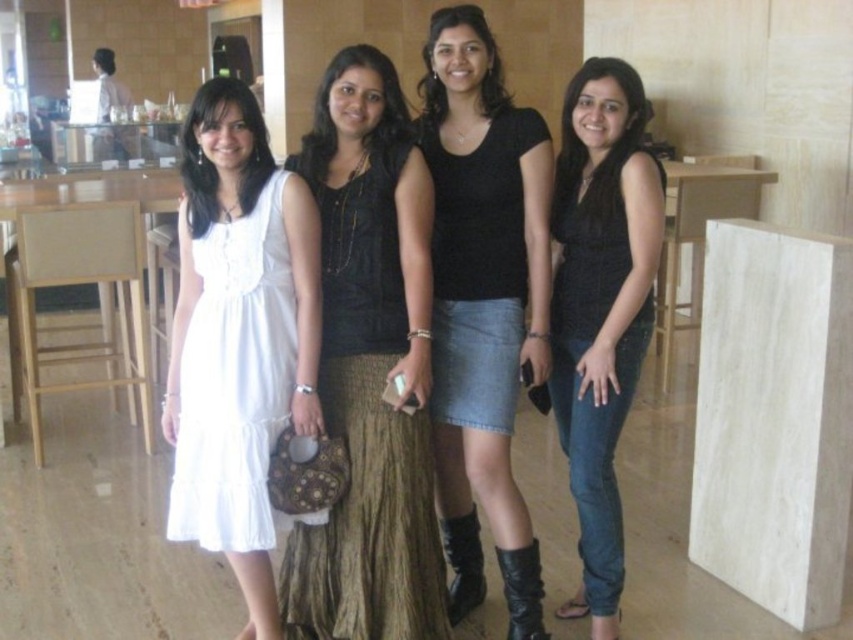
In the scene shown: Is black textured dress at center in front of white satin dress at left?

No, black textured dress at center is further to the viewer.

Between point (584, 166) and point (218, 218), which one is positioned in front?

Positioned in front is point (218, 218).

What are the coordinates of `black textured dress at center` in the screenshot? It's located at (587, 150).

Which is below, brown textured skirt at center or black matte skirt at center?

brown textured skirt at center is below.

How much distance is there between brown textured skirt at center and black matte skirt at center?

The distance of brown textured skirt at center from black matte skirt at center is 30.35 inches.

Who is more forward, (378, 595) or (434, 120)?

Point (378, 595) is more forward.

Where is `brown textured skirt at center`? brown textured skirt at center is located at coordinates (370, 368).

Which is more to the left, denim skirt at center or white cotton dress at left?

white cotton dress at left is more to the left.

Is denim skirt at center to the left of white cotton dress at left from the viewer's perspective?

In fact, denim skirt at center is to the right of white cotton dress at left.

Describe the element at coordinates (483, 304) in the screenshot. The height and width of the screenshot is (640, 853). I see `denim skirt at center` at that location.

This screenshot has width=853, height=640. What are the coordinates of `denim skirt at center` in the screenshot? It's located at (483, 304).